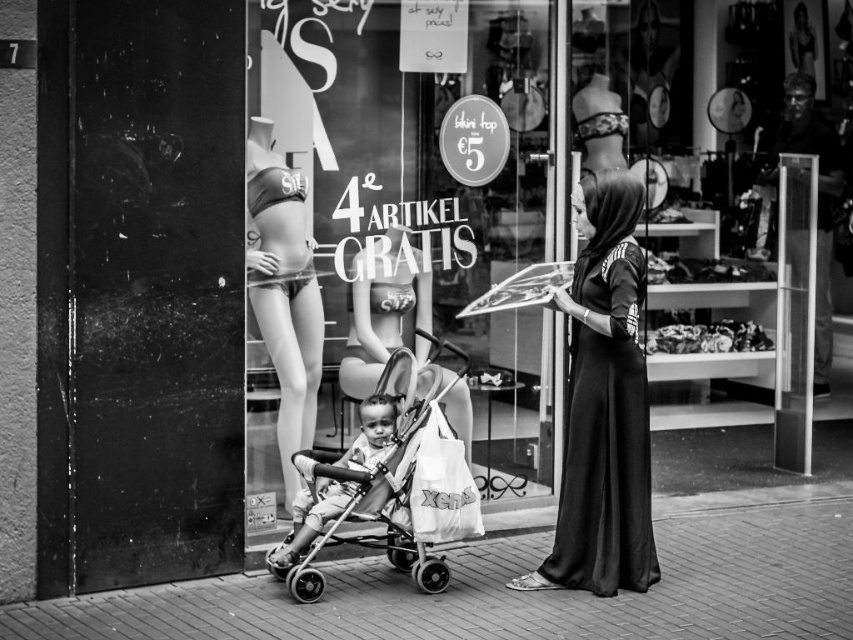
Between transparent glass at center and metallic stroller at center, which one appears on the left side from the viewer's perspective?

From the viewer's perspective, metallic stroller at center appears more on the left side.

Is point (436, 193) in front of point (393, 497)?

No, (436, 193) is further to viewer.

Find the location of a particular element. The width and height of the screenshot is (853, 640). transparent glass at center is located at coordinates (424, 195).

Identify the location of transparent glass at center. The width and height of the screenshot is (853, 640). (424, 195).

Based on the photo, who is higher up, black silk abaya at center or smooth skin mannequin at center?

Positioned higher is smooth skin mannequin at center.

Which is more to the right, black silk abaya at center or smooth skin mannequin at center?

black silk abaya at center

Between point (602, 216) and point (306, 273), which one is positioned behind?

The point (306, 273) is behind.

The height and width of the screenshot is (640, 853). Identify the location of black silk abaya at center. (602, 404).

Which is more to the left, black silk abaya at center or smooth skin baby at center?

From the viewer's perspective, smooth skin baby at center appears more on the left side.

Is black silk abaya at center behind smooth skin baby at center?

No, black silk abaya at center is in front of smooth skin baby at center.

This screenshot has height=640, width=853. Identify the location of black silk abaya at center. (602, 404).

Where is `black silk abaya at center`? This screenshot has height=640, width=853. black silk abaya at center is located at coordinates 602,404.